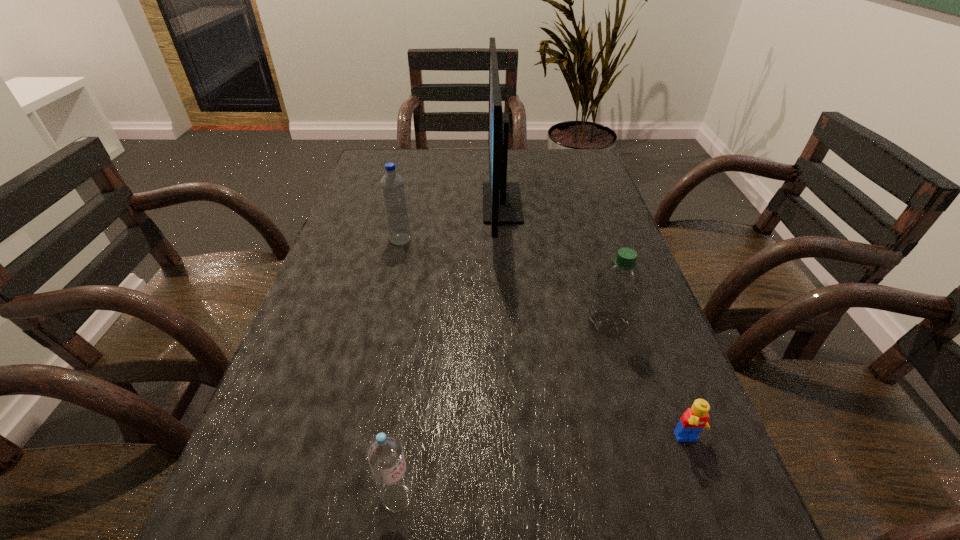
This screenshot has height=540, width=960. I want to click on empty location between the fourth object from right to left and the rightmost object, so click(x=542, y=469).

You are a GUI agent. You are given a task and a screenshot of the screen. Output one action in this format:
    pyautogui.click(x=<x>, y=<y>)
    Task: Click on the free space between the computer monitor and the farthest water bottle
    The height and width of the screenshot is (540, 960).
    Given the screenshot: What is the action you would take?
    pyautogui.click(x=451, y=221)

Image resolution: width=960 pixels, height=540 pixels. I want to click on free space between the second water bottle from right to left and the rightmost water bottle, so pos(503,411).

Find the location of a particular element. This screenshot has width=960, height=540. vacant area that lies between the fourth object from left to right and the computer monitor is located at coordinates (555, 264).

You are a GUI agent. You are given a task and a screenshot of the screen. Output one action in this format:
    pyautogui.click(x=<x>, y=<y>)
    Task: Click on the vacant space that is in between the second farthest water bottle and the second water bottle from left to right
    This screenshot has width=960, height=540.
    Given the screenshot: What is the action you would take?
    pyautogui.click(x=503, y=411)

This screenshot has height=540, width=960. Find the location of `vacant region between the second nearest object and the third farthest object`. vacant region between the second nearest object and the third farthest object is located at coordinates (648, 382).

Identify which object is the third nearest to the third nearest object. Please provide its 2D coordinates. Your answer should be formatted as a tuple, i.e. [(x, y)], where the tuple contains the x and y coordinates of a point satisfying the conditions above.

[(384, 452)]

Identify the location of object that is the closest one to the leftmost water bottle. The image size is (960, 540). (502, 204).

You are a GUI agent. You are given a task and a screenshot of the screen. Output one action in this format:
    pyautogui.click(x=<x>, y=<y>)
    Task: Click on the water bottle that stands as the closest to the tallest object
    Image resolution: width=960 pixels, height=540 pixels.
    Given the screenshot: What is the action you would take?
    pyautogui.click(x=392, y=184)

Locate which water bottle ranks in proximity to the second nearest water bottle. Please provide its 2D coordinates. Your answer should be formatted as a tuple, i.e. [(x, y)], where the tuple contains the x and y coordinates of a point satisfying the conditions above.

[(384, 452)]